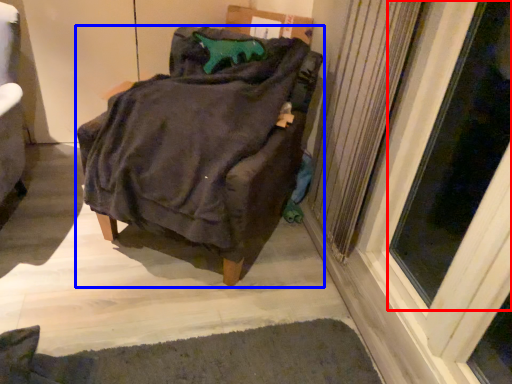
Question: Which of the following is the closest to the observer, screen door (highlighted by a red box) or furniture (highlighted by a blue box)?

Choices:
 (A) screen door
 (B) furniture

Answer: (A)